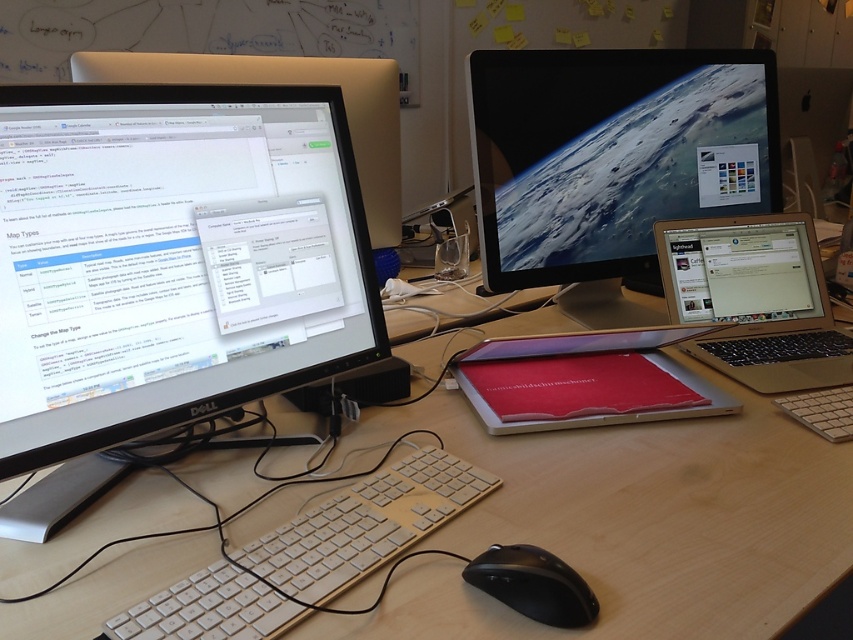
Question: Which of the following is the farthest from the observer?

Choices:
 (A) matte black monitor at left
 (B) white plastic keyboard at center
 (C) red matte tablet at center

Answer: (C)

Question: In this image, where is matte black monitor at left located relative to silver metallic laptop at right?

Choices:
 (A) left
 (B) right

Answer: (A)

Question: Which of the following is the farthest from the observer?

Choices:
 (A) silver metallic laptop at right
 (B) white plastic keyboard at center
 (C) wooden at center

Answer: (A)

Question: In this image, where is silver metallic laptop at right located relative to red matte tablet at center?

Choices:
 (A) right
 (B) left

Answer: (A)

Question: Which object is positioned farthest from the white plastic keyboard at center?

Choices:
 (A) wooden at center
 (B) black matte mouse at lower center

Answer: (B)

Question: Is silver metallic laptop at right smaller than black matte mouse at lower center?

Choices:
 (A) no
 (B) yes

Answer: (A)